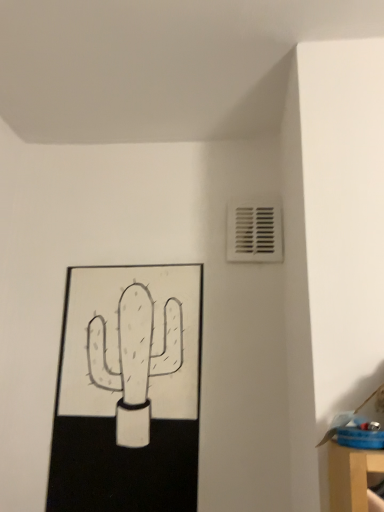
Describe the element at coordinates (254, 231) in the screenshot. I see `white plastic vent at upper right` at that location.

Locate an element on the screen. white plastic vent at upper right is located at coordinates (254, 231).

Find the location of a particular element. The height and width of the screenshot is (512, 384). black matte picture frame at lower left is located at coordinates (128, 390).

What do you see at coordinates (128, 390) in the screenshot?
I see `black matte picture frame at lower left` at bounding box center [128, 390].

At what (x,y) coordinates should I click in order to perform the action: click on white plastic vent at upper right. Please return your answer as a coordinate pair (x, y). Looking at the image, I should click on (254, 231).

Is white plastic vent at upper right to the left or to the right of black matte picture frame at lower left in the image?

white plastic vent at upper right is to the right of black matte picture frame at lower left.

Considering the relative positions of white plastic vent at upper right and black matte picture frame at lower left in the image provided, is white plastic vent at upper right in front of black matte picture frame at lower left?

No, it is not.

From the picture: Which point is more forward, (x=251, y=254) or (x=80, y=506)?

The point (x=80, y=506) is closer to the camera.

From the image's perspective, which one is positioned higher, white plastic vent at upper right or black matte picture frame at lower left?

white plastic vent at upper right is shown above in the image.

From a real-world perspective, is white plastic vent at upper right above or below black matte picture frame at lower left?

Clearly, from a real-world perspective, white plastic vent at upper right is above black matte picture frame at lower left.

Which of these two, white plastic vent at upper right or black matte picture frame at lower left, is wider?

black matte picture frame at lower left is wider.

Considering the sizes of objects white plastic vent at upper right and black matte picture frame at lower left in the image provided, who is shorter, white plastic vent at upper right or black matte picture frame at lower left?

Standing shorter between the two is white plastic vent at upper right.

Based on their sizes in the image, would you say white plastic vent at upper right is bigger or smaller than black matte picture frame at lower left?

white plastic vent at upper right is smaller than black matte picture frame at lower left.

Does white plastic vent at upper right contain black matte picture frame at lower left?

Actually, black matte picture frame at lower left is outside white plastic vent at upper right.

Is white plastic vent at upper right placed right next to black matte picture frame at lower left?

There is a gap between white plastic vent at upper right and black matte picture frame at lower left.

Is white plastic vent at upper right oriented away from black matte picture frame at lower left?

No.

How many degrees apart are the facing directions of white plastic vent at upper right and black matte picture frame at lower left?

The facing directions of white plastic vent at upper right and black matte picture frame at lower left are 2.38 degrees apart.

How much distance is there between white plastic vent at upper right and black matte picture frame at lower left?

white plastic vent at upper right is 13.94 inches from black matte picture frame at lower left.

Locate an element on the screen. The height and width of the screenshot is (512, 384). air conditioning lying on the right of black matte picture frame at lower left is located at coordinates click(x=254, y=231).

Considering the relative positions of black matte picture frame at lower left and white plastic vent at upper right in the image provided, is black matte picture frame at lower left to the left of white plastic vent at upper right from the viewer's perspective?

Correct, you'll find black matte picture frame at lower left to the left of white plastic vent at upper right.

From the picture: Is black matte picture frame at lower left in front of or behind white plastic vent at upper right in the image?

In the image, black matte picture frame at lower left appears in front of white plastic vent at upper right.

Is point (139, 336) closer or farther from the camera than point (230, 207)?

Clearly, point (139, 336) is closer to the camera than point (230, 207).

From the image's perspective, who appears lower, black matte picture frame at lower left or white plastic vent at upper right?

black matte picture frame at lower left.

From the picture: From a real-world perspective, is black matte picture frame at lower left on top of white plastic vent at upper right?

No, from a real-world perspective, black matte picture frame at lower left is not above white plastic vent at upper right.

Is black matte picture frame at lower left thinner than white plastic vent at upper right?

No.

Does black matte picture frame at lower left have a greater height compared to white plastic vent at upper right?

Correct, black matte picture frame at lower left is much taller as white plastic vent at upper right.

Based on their sizes in the image, would you say black matte picture frame at lower left is bigger or smaller than white plastic vent at upper right?

Considering their sizes, black matte picture frame at lower left takes up more space than white plastic vent at upper right.

Would you say black matte picture frame at lower left contains white plastic vent at upper right?

No, white plastic vent at upper right is not a part of black matte picture frame at lower left.

Is there a large distance between black matte picture frame at lower left and white plastic vent at upper right?

black matte picture frame at lower left is near white plastic vent at upper right, not far away.

Does black matte picture frame at lower left turn towards white plastic vent at upper right?

No, black matte picture frame at lower left does not turn towards white plastic vent at upper right.

How different are the orientations of black matte picture frame at lower left and white plastic vent at upper right in degrees?

2.38 degrees.

At what (x,y) coordinates should I click in order to perform the action: click on air conditioning that appears on the right of black matte picture frame at lower left. Please return your answer as a coordinate pair (x, y). Looking at the image, I should click on (254, 231).

Locate an element on the screen. The width and height of the screenshot is (384, 512). picture frame that appears in front of the white plastic vent at upper right is located at coordinates (128, 390).

At what (x,y) coordinates should I click in order to perform the action: click on picture frame below the white plastic vent at upper right (from the image's perspective). Please return your answer as a coordinate pair (x, y). Looking at the image, I should click on (128, 390).